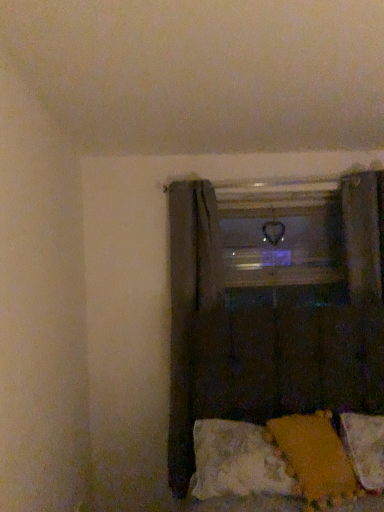
Question: Based on their sizes in the image, would you say dark fabric curtain at lower right, the 2th curtain when ordered from back to front, is bigger or smaller than transparent glass window frame at center?

Choices:
 (A) big
 (B) small

Answer: (A)

Question: From the image's perspective, is dark fabric curtain at lower right, which is counted as the first curtain, starting from the front, above or below transparent glass window frame at center?

Choices:
 (A) above
 (B) below

Answer: (B)

Question: Estimate the real-world distances between objects in this image. Which object is closer to the white soft pillow at lower right, which is the second pillow from left to right?

Choices:
 (A) velvety orange pillow at lower right, positioned as the first pillow in left-to-right order
 (B) textured yellow fabric at lower right
 (C) transparent glass window frame at center
 (D) dark fabric curtain at lower right, which is counted as the first curtain, starting from the front
 (E) dark fabric curtain at center, which is the second curtain in front-to-back order

Answer: (A)

Question: Based on their relative distances, which object is nearer to the dark fabric curtain at lower right, the 2th curtain when ordered from back to front?

Choices:
 (A) textured yellow fabric at lower right
 (B) transparent glass window frame at center
 (C) dark fabric curtain at center, which is the second curtain in front-to-back order
 (D) velvety orange pillow at lower right, acting as the 2th pillow starting from the right
 (E) white soft pillow at lower right, the 1th pillow in the right-to-left sequence

Answer: (B)